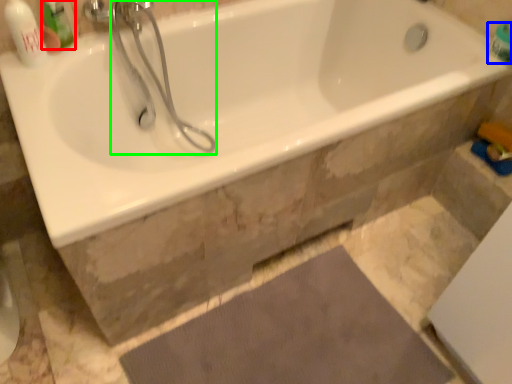
Question: Which object is the farthest from mouthwash (highlighted by a red box)? Choose among these: toiletry (highlighted by a blue box) or shower (highlighted by a green box).

Choices:
 (A) toiletry
 (B) shower

Answer: (A)